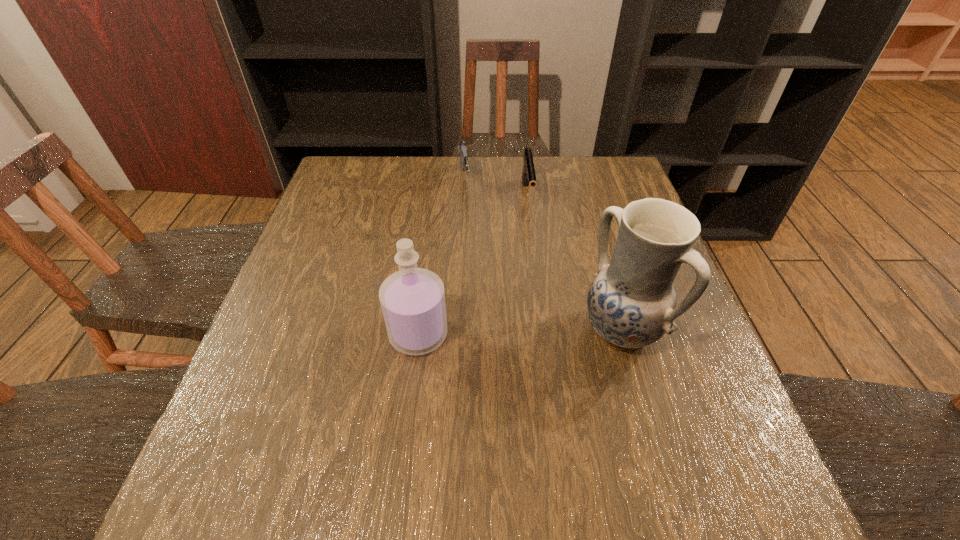
Locate an element on the screen. Image resolution: width=960 pixels, height=540 pixels. free spot between the rightmost object and the perfume is located at coordinates (519, 332).

Where is `vacant space that is in between the gun and the pottery`? This screenshot has width=960, height=540. vacant space that is in between the gun and the pottery is located at coordinates click(x=542, y=256).

Identify the location of empty space that is in between the rightmost object and the perfume. (519, 332).

This screenshot has width=960, height=540. I want to click on the closest object to the third object from left to right, so click(462, 147).

The height and width of the screenshot is (540, 960). What are the coordinates of `the second closest object to the pistol` in the screenshot? It's located at (631, 303).

At what (x,y) coordinates should I click in order to perform the action: click on free location that satisfies the following two spatial constraints: 1. on the back side of the pottery; 2. on the right side of the perfume. Please return your answer as a coordinate pair (x, y). The width and height of the screenshot is (960, 540). Looking at the image, I should click on (420, 329).

You are a GUI agent. You are given a task and a screenshot of the screen. Output one action in this format:
    pyautogui.click(x=<x>, y=<y>)
    Task: Click on the vacant space that satisfies the following two spatial constraints: 1. on the back side of the pistol; 2. on the left side of the third shortest object
    This screenshot has height=540, width=960.
    Given the screenshot: What is the action you would take?
    pyautogui.click(x=436, y=197)